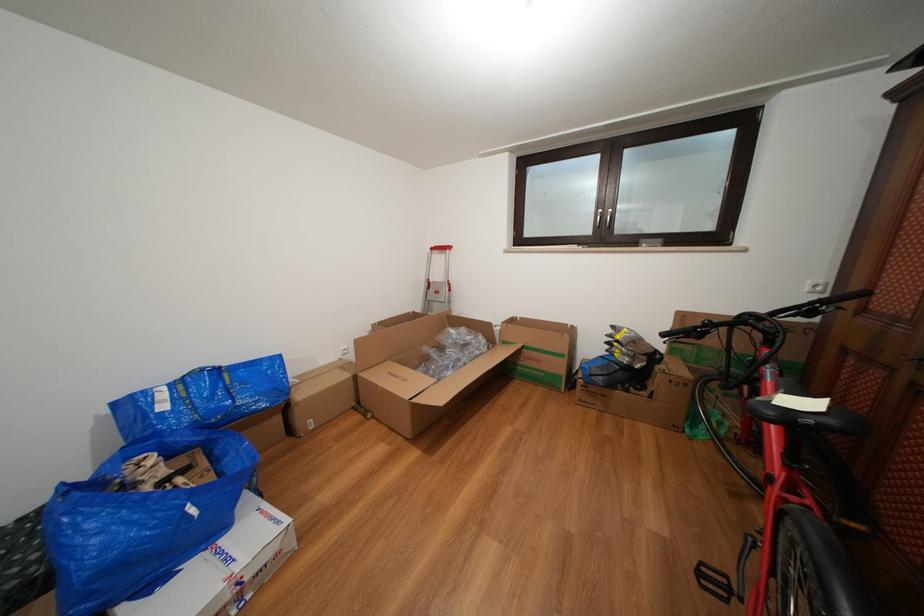
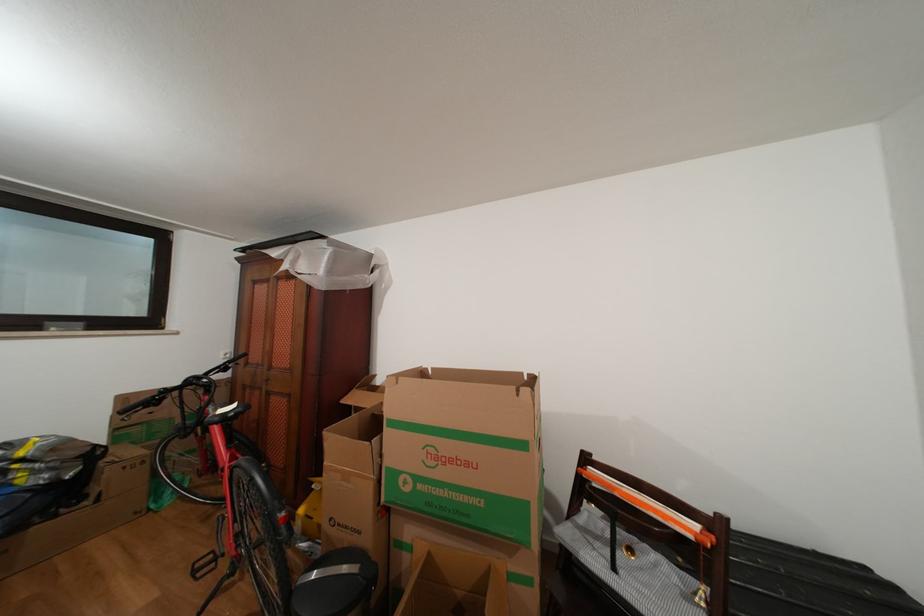
Find the pixel in the second image that matches [815,294] in the first image.

(229, 363)